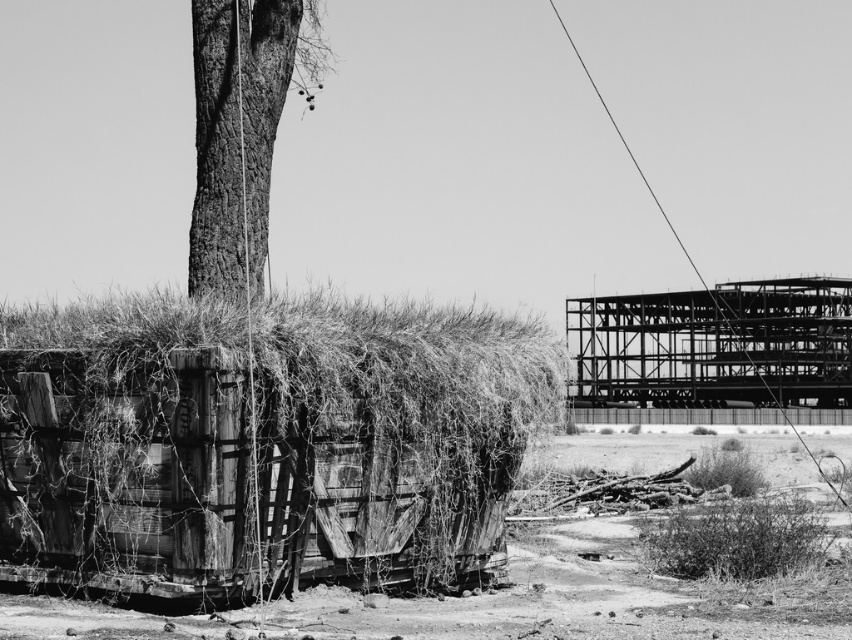
Measure the distance between rusty wood hay at left and dirt field at lower left.

rusty wood hay at left and dirt field at lower left are 114.30 feet apart from each other.

Is rusty wood hay at left to the left of dirt field at lower left from the viewer's perspective?

Indeed, rusty wood hay at left is positioned on the left side of dirt field at lower left.

The image size is (852, 640). What are the coordinates of `rusty wood hay at left` in the screenshot? It's located at (263, 444).

Can you confirm if rusty wood hay at left is thinner than smooth bark tree at upper left?

Correct, rusty wood hay at left's width is less than smooth bark tree at upper left's.

Where is `rusty wood hay at left`? rusty wood hay at left is located at coordinates (263, 444).

Which is below, rusty wood hay at left or metallic framework at right?

Positioned lower is metallic framework at right.

Is point (315, 545) positioned in front of point (634, 312)?

Yes, it is.

Does point (140, 582) lie in front of point (810, 320)?

Yes, it is.

Locate an element on the screen. This screenshot has width=852, height=640. rusty wood hay at left is located at coordinates (263, 444).